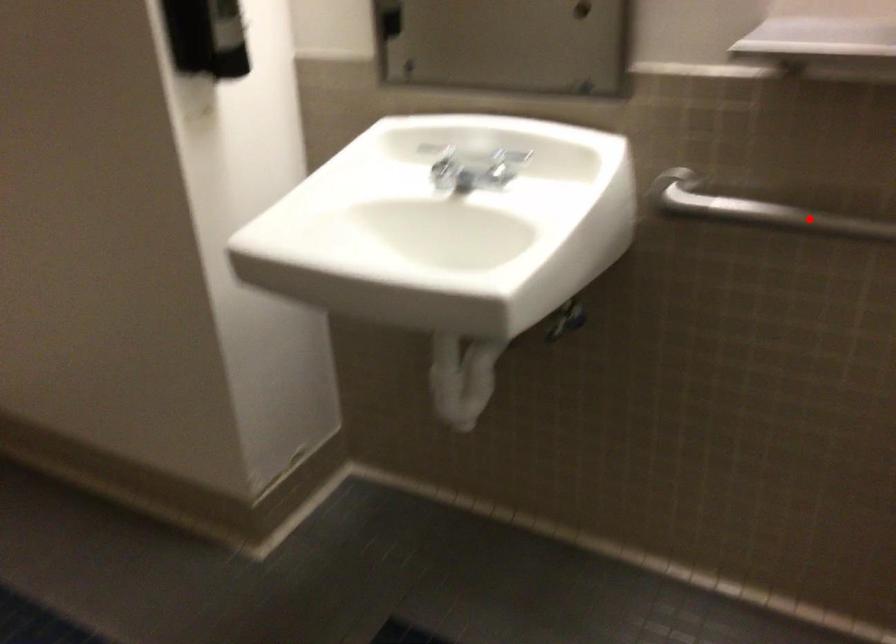
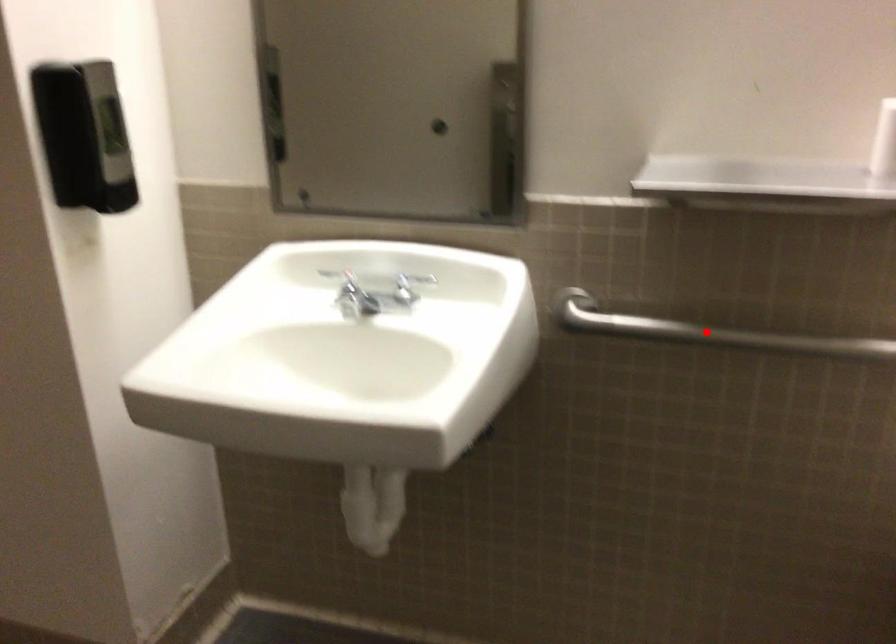
I am providing you with two images of the same scene from different viewpoints. A red point is marked on the first image and another point is marked on the second image. Do the highlighted points in image1 and image2 indicate the same real-world spot?

Yes